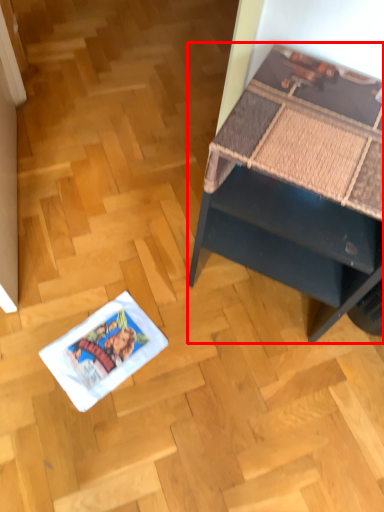
Question: Where is desk (annotated by the red box) located in relation to comic book in the image?

Choices:
 (A) right
 (B) left

Answer: (A)